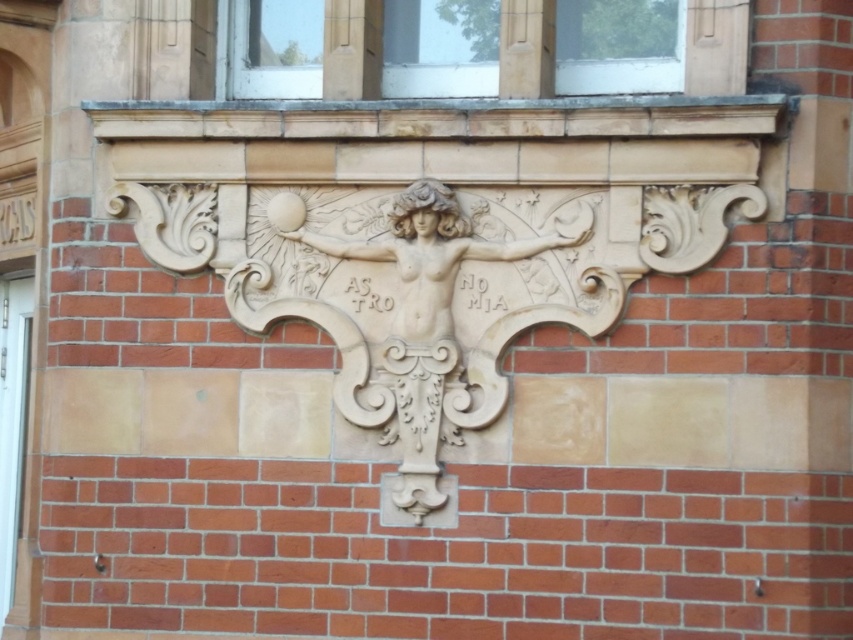
Who is positioned more to the left, white stone relief at center or white stone writing at center?

white stone relief at center

This screenshot has height=640, width=853. Describe the element at coordinates (447, 292) in the screenshot. I see `white stone relief at center` at that location.

Image resolution: width=853 pixels, height=640 pixels. In order to click on white stone relief at center in this screenshot , I will do `click(447, 292)`.

Between point (407, 13) and point (482, 276), which one is positioned behind?

Point (407, 13)

This screenshot has height=640, width=853. Find the location of `matte glass window at upper center`. matte glass window at upper center is located at coordinates (665, 58).

Does point (231, 3) come closer to viewer compared to point (491, 307)?

No, it is behind (491, 307).

You are a GUI agent. You are given a task and a screenshot of the screen. Output one action in this format:
    pyautogui.click(x=<x>, y=<y>)
    Task: Click on the matte glass window at upper center
    This screenshot has height=640, width=853.
    Given the screenshot: What is the action you would take?
    pyautogui.click(x=665, y=58)

The image size is (853, 640). What do you see at coordinates (447, 292) in the screenshot?
I see `white stone relief at center` at bounding box center [447, 292].

Where is `white stone relief at center`? This screenshot has height=640, width=853. white stone relief at center is located at coordinates (447, 292).